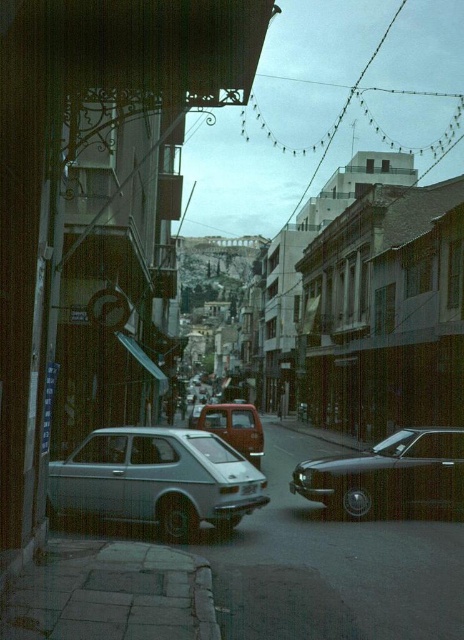
Based on the photo, you are a delivery driver who needs to park your vehicle in this narrow street. Your vehicle has a height restriction of 2 meters. Can you safely park the matte red truck at center without hitting the white plastic license plate at center?

The matte red truck at center is much taller than the white plastic license plate at center, so it might hit the license plate if parked here. Therefore, you should not park the matte red truck at center in this spot.

You are a pedestrian standing at the edge of the narrow urban street. You see the matte red truck at center and the white plastic license plate at center. Which object is closer to you?

The matte red truck at center is closer to you than the white plastic license plate at center.

You are a delivery driver who needs to park your matte red truck at center in a specific spot marked by a point at coordinates (233,428). Can you confirm if the truck is already positioned correctly at that point?

The point at coordinates (233,428) marks the matte red truck at center, so yes, the truck is correctly positioned at that point.